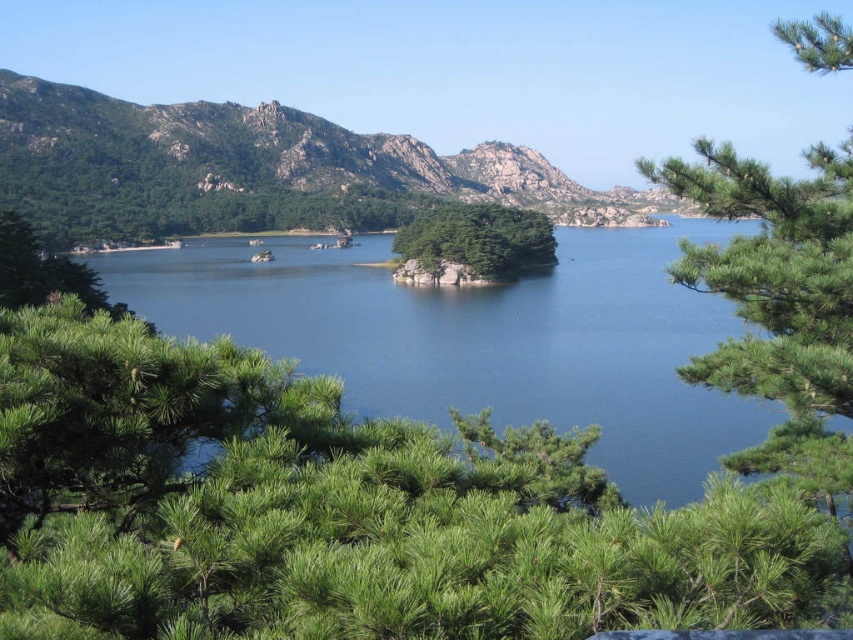
Can you confirm if blue water at center is bigger than green leafy tree at center?

Indeed, blue water at center has a larger size compared to green leafy tree at center.

Which is more to the left, blue water at center or green leafy tree at center?

From the viewer's perspective, blue water at center appears more on the left side.

Find the location of a particular element. The height and width of the screenshot is (640, 853). blue water at center is located at coordinates (482, 339).

Does blue water at center have a greater height compared to green needle-like leaves at upper right?

Indeed, blue water at center has a greater height compared to green needle-like leaves at upper right.

Who is more forward, (291, 324) or (838, 257)?

Point (838, 257)

Which is in front, point (660, 264) or point (837, 262)?

Positioned in front is point (837, 262).

The width and height of the screenshot is (853, 640). In order to click on blue water at center in this screenshot , I will do `click(482, 339)`.

Is green needle-like leaves at upper right above green leafy tree at center?

No.

Does green needle-like leaves at upper right have a larger size compared to green leafy tree at center?

No, green needle-like leaves at upper right is not bigger than green leafy tree at center.

The width and height of the screenshot is (853, 640). What do you see at coordinates (778, 301) in the screenshot? I see `green needle-like leaves at upper right` at bounding box center [778, 301].

Locate an element on the screen. The image size is (853, 640). green needle-like leaves at upper right is located at coordinates (778, 301).